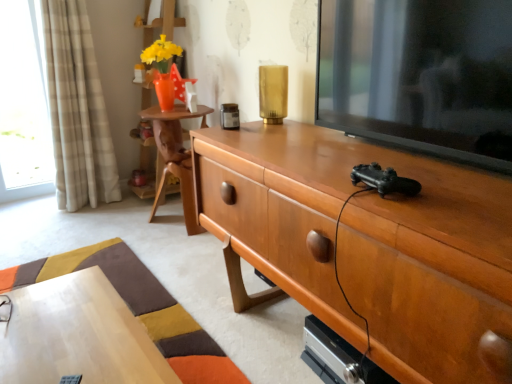
At what (x,y) coordinates should I click in order to perform the action: click on vacant space positioned to the left of beige plaid curtain at left. Please return your answer as a coordinate pair (x, y). This screenshot has height=384, width=512. Looking at the image, I should click on (32, 209).